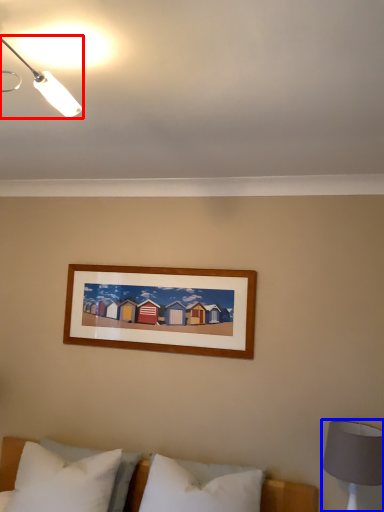
Question: Which point is further to the camera, lamp (highlighted by a red box) or bedside lamp (highlighted by a blue box)?

Choices:
 (A) lamp
 (B) bedside lamp

Answer: (B)